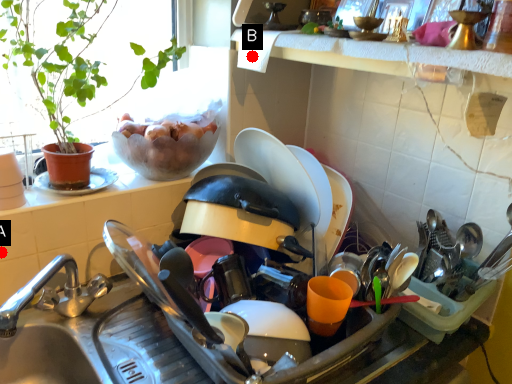
Question: Two points are circled on the image, labeled by A and B beside each circle. Which point appears farthest from the camera in this image?

Choices:
 (A) A is further
 (B) B is further

Answer: (B)